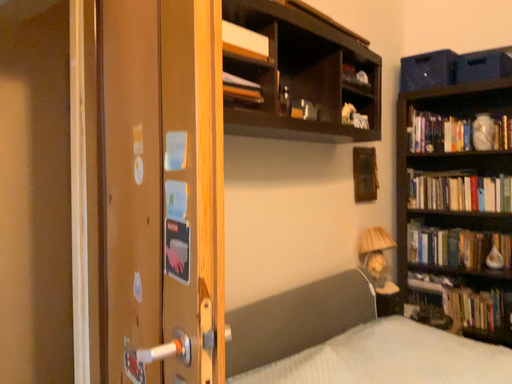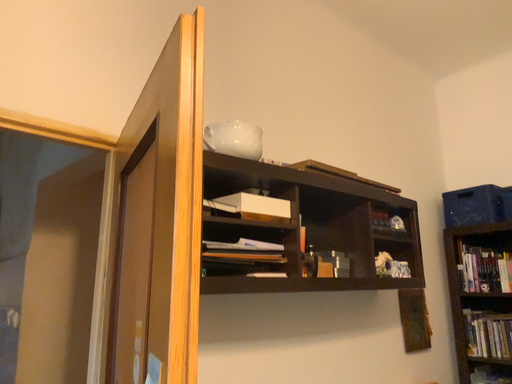
Question: How did the camera likely rotate when shooting the video?

Choices:
 (A) rotated upward
 (B) rotated downward

Answer: (A)